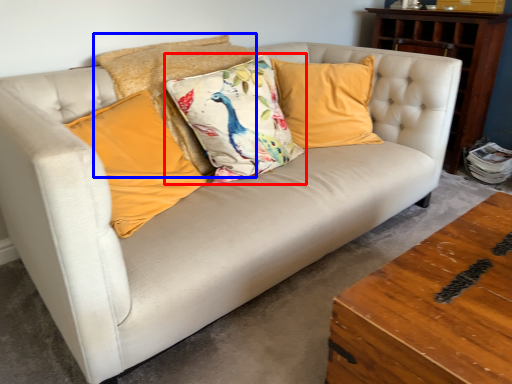
Question: Which point is further to the camera, pillow (highlighted by a red box) or pillow (highlighted by a blue box)?

Choices:
 (A) pillow
 (B) pillow

Answer: (B)